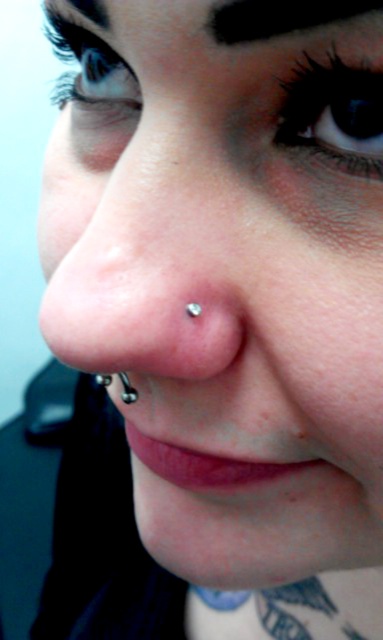
Question: Considering the real-world distances, which object is farthest from the matte pink lipstick at lower center?

Choices:
 (A) clear skin nose piercing at center
 (B) matte blue eye at upper left
 (C) silver metallic stud at nose
 (D) black hair at upper left

Answer: (B)

Question: Is black hair at upper left smaller than silver metallic stud at nose?

Choices:
 (A) no
 (B) yes

Answer: (A)

Question: Among these points, which one is farthest from the camera?

Choices:
 (A) click(x=204, y=467)
 (B) click(x=117, y=116)

Answer: (B)

Question: Does blue iridescent eye at upper center lie behind black hair at upper left?

Choices:
 (A) no
 (B) yes

Answer: (A)

Question: Can you confirm if matte pink lipstick at lower center is wider than silver metallic stud at nose?

Choices:
 (A) yes
 (B) no

Answer: (A)

Question: Which object is closer to the camera taking this photo?

Choices:
 (A) silver metallic stud at nose
 (B) clear skin nose piercing at center
 (C) blue iridescent eye at upper center

Answer: (C)